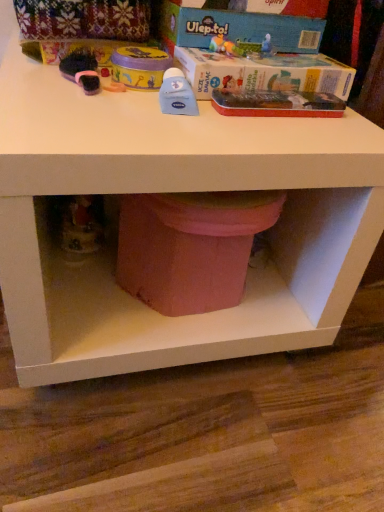
You are a GUI agent. You are given a task and a screenshot of the screen. Output one action in this format:
    pyautogui.click(x=<x>, y=<y>)
    Task: Click on the free point above matte pink potty at lower center (from a real-world perspective)
    
    Given the screenshot: What is the action you would take?
    (222, 201)